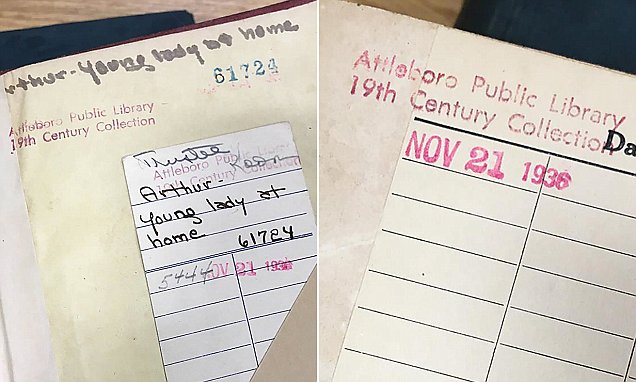
I want to click on brown book back, so click(x=273, y=9).